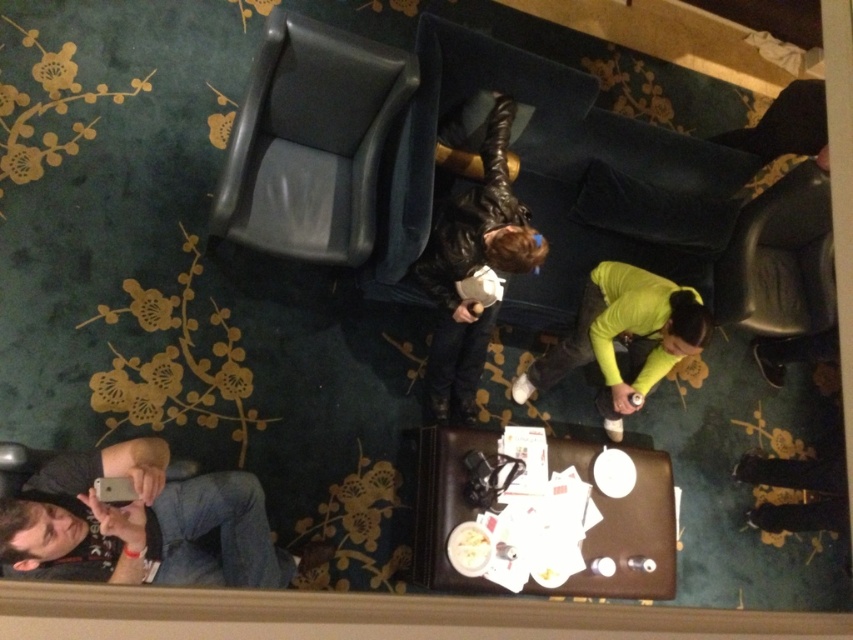
You are standing at the edge of the lounge area and want to place a new decorative item on the floor. The coordinates for placing it must be exactly 0.1 units to the right and 0.05 units above the brown leather luggage at center. What are the new coordinates for the placement?

The new coordinates would be calculated by adding 0.1 to the x coordinate and subtracting 0.05 from the y coordinate of the brown leather luggage at center. The original coordinates are (631, 536). Adding 0.1 to 0.839 gives 0.939, and subtracting 0.05 from 0.741 gives 0.691. Therefore, the new coordinates are (589, 600).